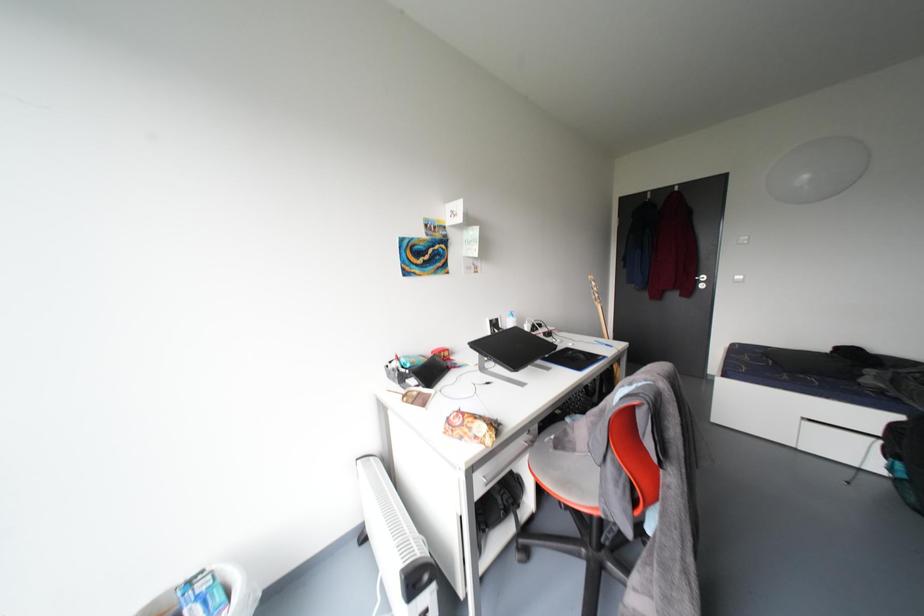
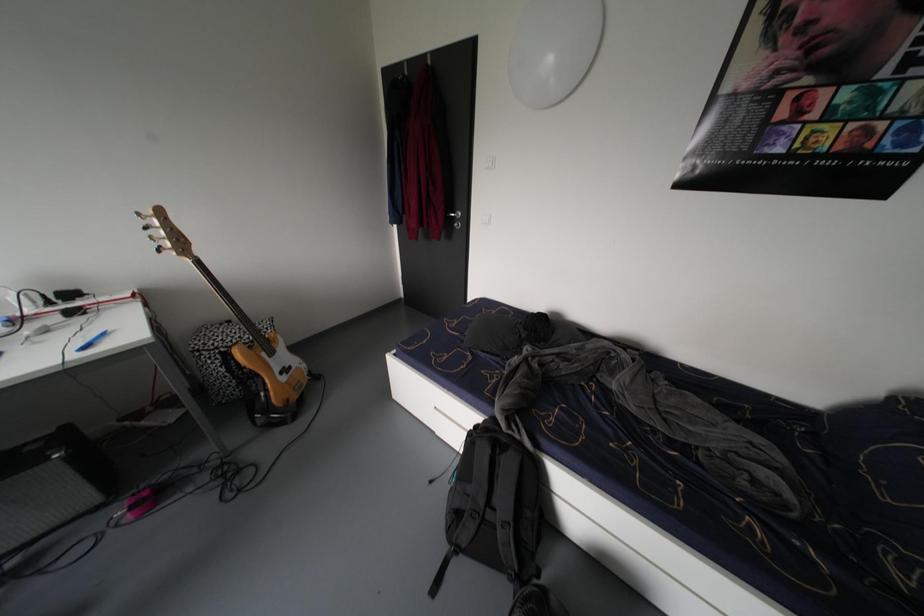
Question: The images are taken continuously from a first-person perspective. In which direction are you moving?

Choices:
 (A) Left
 (B) Right
 (C) Forward
 (D) Backward

Answer: (B)